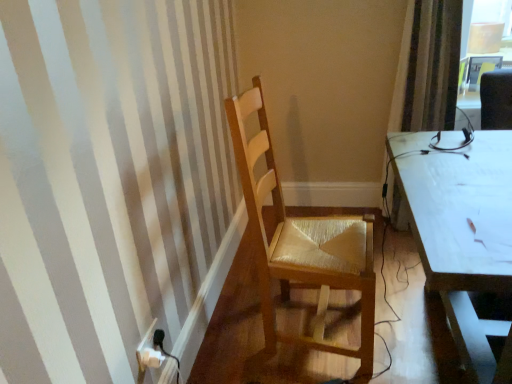
Question: From the image's perspective, is white plastic power plugs and sockets at lower left below striped fabric curtain at right?

Choices:
 (A) yes
 (B) no

Answer: (A)

Question: Is striped fabric curtain at right surrounded by white plastic power plugs and sockets at lower left?

Choices:
 (A) no
 (B) yes

Answer: (A)

Question: Is white plastic power plugs and sockets at lower left positioned behind striped fabric curtain at right?

Choices:
 (A) no
 (B) yes

Answer: (A)

Question: From the image's perspective, is white plastic power plugs and sockets at lower left on top of striped fabric curtain at right?

Choices:
 (A) no
 (B) yes

Answer: (A)

Question: Considering the relative sizes of white plastic power plugs and sockets at lower left and striped fabric curtain at right in the image provided, is white plastic power plugs and sockets at lower left bigger than striped fabric curtain at right?

Choices:
 (A) yes
 (B) no

Answer: (B)

Question: Does white plastic power plugs and sockets at lower left have a lesser width compared to striped fabric curtain at right?

Choices:
 (A) yes
 (B) no

Answer: (A)

Question: From a real-world perspective, is striped fabric curtain at right positioned under light brown wood chair at center based on gravity?

Choices:
 (A) no
 (B) yes

Answer: (A)

Question: From the image's perspective, is striped fabric curtain at right under light brown wood chair at center?

Choices:
 (A) yes
 (B) no

Answer: (B)

Question: Considering the relative sizes of striped fabric curtain at right and light brown wood chair at center in the image provided, is striped fabric curtain at right shorter than light brown wood chair at center?

Choices:
 (A) yes
 (B) no

Answer: (B)

Question: Considering the relative sizes of striped fabric curtain at right and light brown wood chair at center in the image provided, is striped fabric curtain at right wider than light brown wood chair at center?

Choices:
 (A) no
 (B) yes

Answer: (A)

Question: Are striped fabric curtain at right and light brown wood chair at center beside each other?

Choices:
 (A) yes
 (B) no

Answer: (B)

Question: Considering the relative sizes of striped fabric curtain at right and light brown wood chair at center in the image provided, is striped fabric curtain at right taller than light brown wood chair at center?

Choices:
 (A) yes
 (B) no

Answer: (A)

Question: Can you confirm if striped fabric curtain at right is wider than white plastic power plugs and sockets at lower left?

Choices:
 (A) no
 (B) yes

Answer: (B)